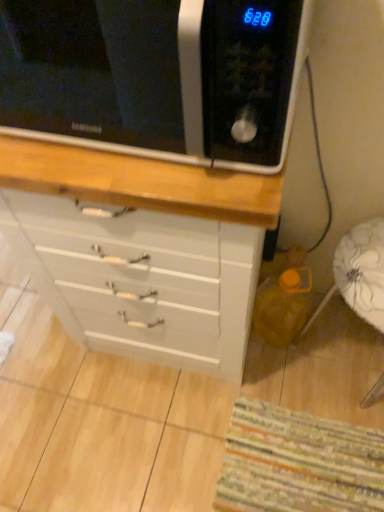
Question: Would you say black matte microwave at upper left contains white fabric swivel chair at lower right?

Choices:
 (A) no
 (B) yes

Answer: (A)

Question: From a real-world perspective, is black matte microwave at upper left on white fabric swivel chair at lower right?

Choices:
 (A) yes
 (B) no

Answer: (A)

Question: From the image's perspective, is black matte microwave at upper left located beneath white fabric swivel chair at lower right?

Choices:
 (A) no
 (B) yes

Answer: (A)

Question: Does black matte microwave at upper left lie behind white fabric swivel chair at lower right?

Choices:
 (A) yes
 (B) no

Answer: (B)

Question: Considering the relative positions of black matte microwave at upper left and white fabric swivel chair at lower right in the image provided, is black matte microwave at upper left to the right of white fabric swivel chair at lower right from the viewer's perspective?

Choices:
 (A) yes
 (B) no

Answer: (B)

Question: Is black matte microwave at upper left not within white fabric swivel chair at lower right?

Choices:
 (A) no
 (B) yes

Answer: (B)

Question: Can you confirm if striped fabric mat at lower right is bigger than black matte microwave at upper left?

Choices:
 (A) no
 (B) yes

Answer: (A)

Question: Can we say striped fabric mat at lower right lies outside black matte microwave at upper left?

Choices:
 (A) yes
 (B) no

Answer: (A)

Question: Is striped fabric mat at lower right far from black matte microwave at upper left?

Choices:
 (A) yes
 (B) no

Answer: (A)

Question: Is striped fabric mat at lower right positioned in front of black matte microwave at upper left?

Choices:
 (A) no
 (B) yes

Answer: (A)

Question: Considering the relative sizes of striped fabric mat at lower right and black matte microwave at upper left in the image provided, is striped fabric mat at lower right thinner than black matte microwave at upper left?

Choices:
 (A) yes
 (B) no

Answer: (B)

Question: Is striped fabric mat at lower right shorter than black matte microwave at upper left?

Choices:
 (A) yes
 (B) no

Answer: (A)

Question: Does white glossy chest of drawers at center appear on the left side of black matte microwave at upper left?

Choices:
 (A) no
 (B) yes

Answer: (B)